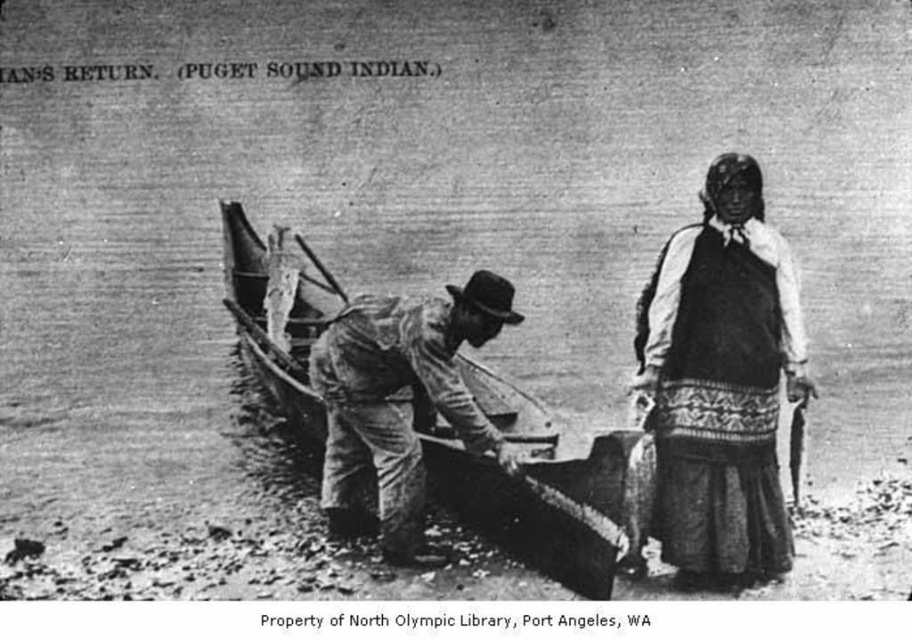
Which of these two, wooden canoe at center or rough wooden oar at center, stands taller?

wooden canoe at center is taller.

Is point (548, 428) closer to camera compared to point (400, 416)?

That is False.

What are the coordinates of `wooden canoe at center` in the screenshot? It's located at (536, 488).

The image size is (912, 640). Identify the location of wooden canoe at center. (536, 488).

Who is more forward, (707, 182) or (413, 531)?

Point (707, 182) is more forward.

Describe the element at coordinates (721, 381) in the screenshot. I see `patterned fabric dress at center` at that location.

Locate an element on the screen. patterned fabric dress at center is located at coordinates (721, 381).

Does patterned fabric dress at center have a lesser width compared to wooden canoe at center?

Yes.

Between patterned fabric dress at center and wooden canoe at center, which one has more height?

wooden canoe at center

Does point (745, 484) come closer to viewer compared to point (436, 474)?

Yes, point (745, 484) is closer to viewer.

At what (x,y) coordinates should I click in order to perform the action: click on patterned fabric dress at center. Please return your answer as a coordinate pair (x, y). The width and height of the screenshot is (912, 640). Looking at the image, I should click on (721, 381).